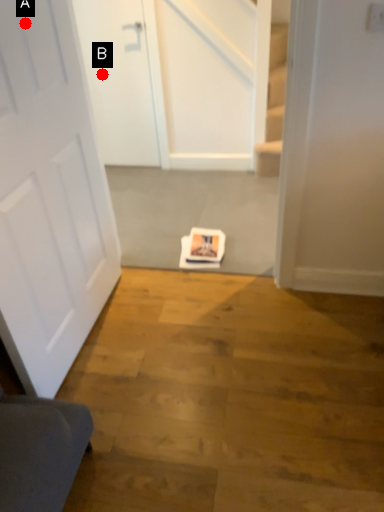
Question: Two points are circled on the image, labeled by A and B beside each circle. Which of the following is the farthest from the observer?

Choices:
 (A) A is further
 (B) B is further

Answer: (B)